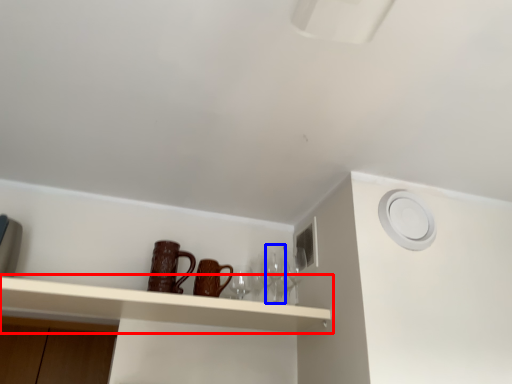
Question: Among these objects, which one is nearest to the camera, shelf (highlighted by a red box) or wine glass (highlighted by a blue box)?

Choices:
 (A) shelf
 (B) wine glass

Answer: (A)